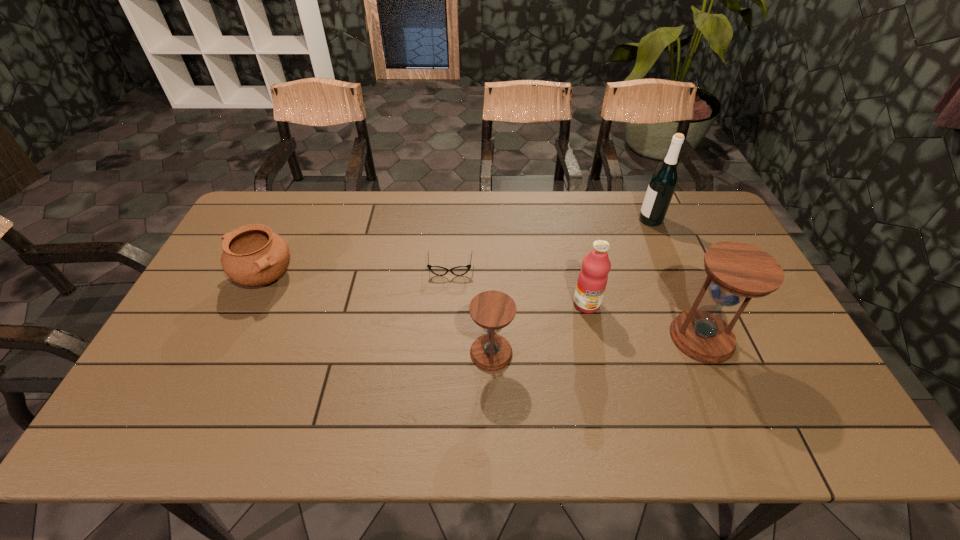
I want to click on object located at the left edge, so click(253, 255).

Locate an element on the screen. object that is at the right edge is located at coordinates (735, 271).

Where is `free location at the far edge`? The width and height of the screenshot is (960, 540). free location at the far edge is located at coordinates (390, 194).

Where is `free space at the near edge of the desktop`? free space at the near edge of the desktop is located at coordinates (485, 374).

Locate an element on the screen. The height and width of the screenshot is (540, 960). vacant space at the left edge of the desktop is located at coordinates point(239,285).

In order to click on vacant space at the right edge of the desktop in this screenshot , I will do `click(766, 367)`.

In the image, there is a desktop. Where is `vacant space at the far left corner`? The height and width of the screenshot is (540, 960). vacant space at the far left corner is located at coordinates (282, 201).

Where is `vacant area that lies between the second shortest object and the third object from right to left`? The image size is (960, 540). vacant area that lies between the second shortest object and the third object from right to left is located at coordinates (425, 291).

Find the location of `vacant area that lies between the pottery and the spectacles`. vacant area that lies between the pottery and the spectacles is located at coordinates (357, 273).

This screenshot has width=960, height=540. Find the location of `empty space that is in between the wine bottle and the left hourglass`. empty space that is in between the wine bottle and the left hourglass is located at coordinates (571, 286).